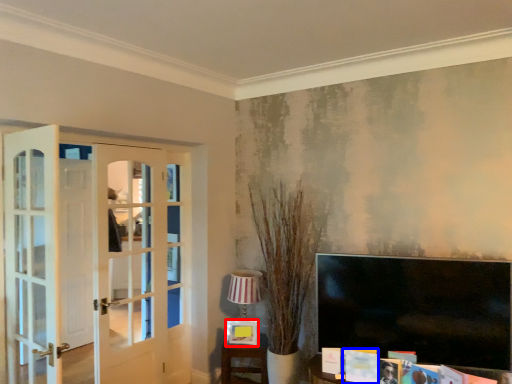
Question: Which of the following is the closest to the observer, picture frame (highlighted by a red box) or magazine (highlighted by a blue box)?

Choices:
 (A) picture frame
 (B) magazine

Answer: (B)